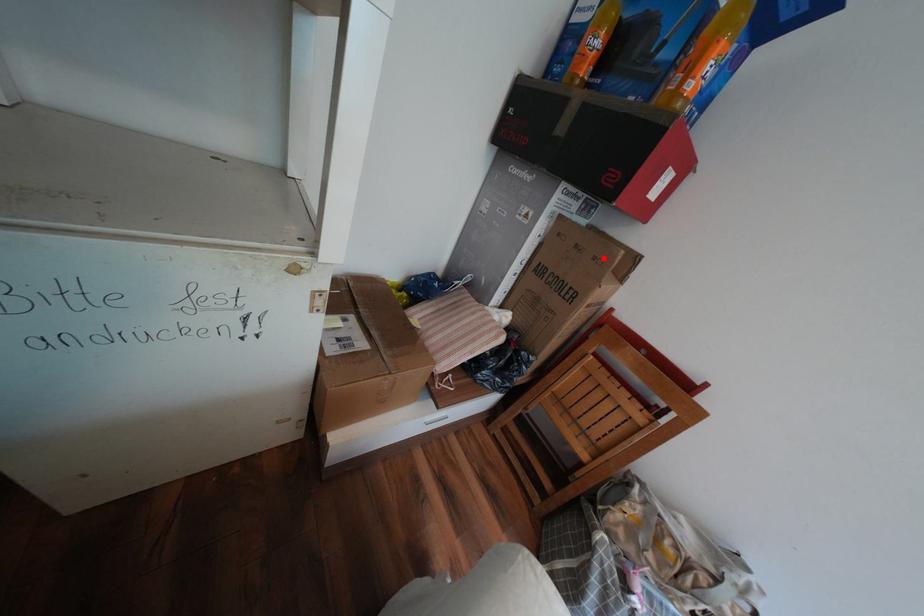
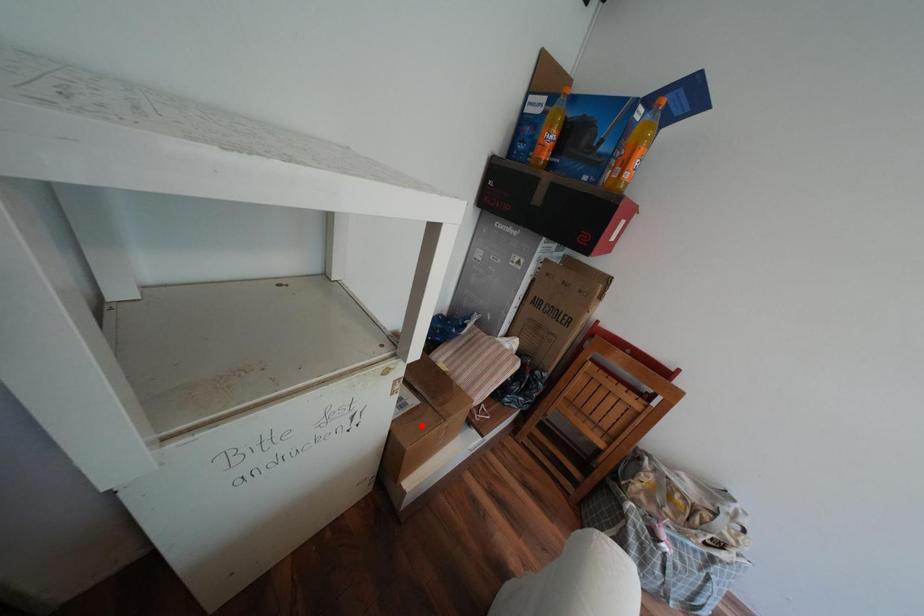
I am providing you with two images of the same scene from different viewpoints. A red point is marked on the first image and another point is marked on the second image. Is the red point in image1 aligned with the point shown in image2?

No